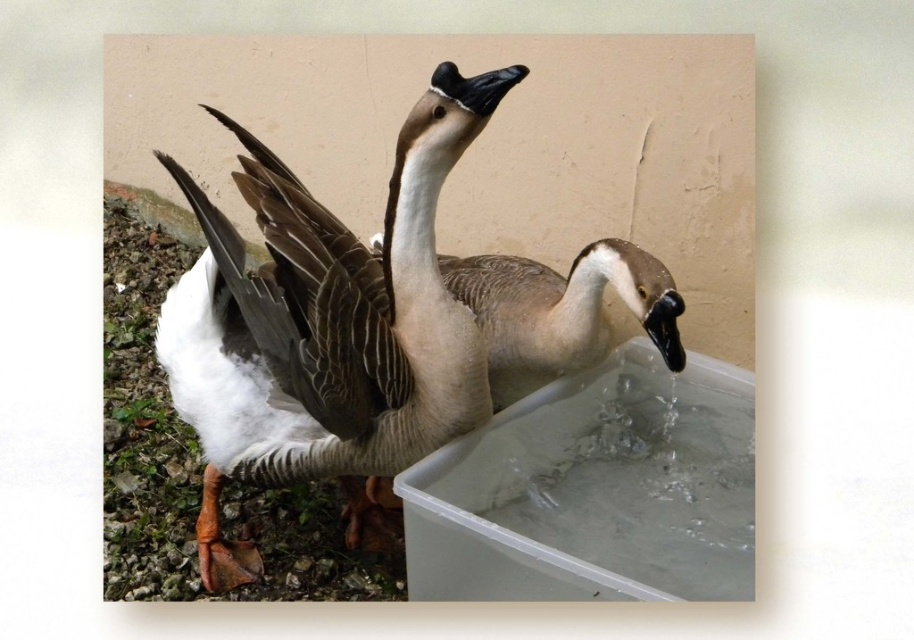
Between white matte goose at center and gray matte goose at center, which one appears on the left side from the viewer's perspective?

white matte goose at center

Is point (247, 369) positioned after point (496, 316)?

No, (247, 369) is in front of (496, 316).

Who is more forward, [263,449] or [532,308]?

Point [263,449] is more forward.

The image size is (914, 640). What are the coordinates of `white matte goose at center` in the screenshot? It's located at (327, 328).